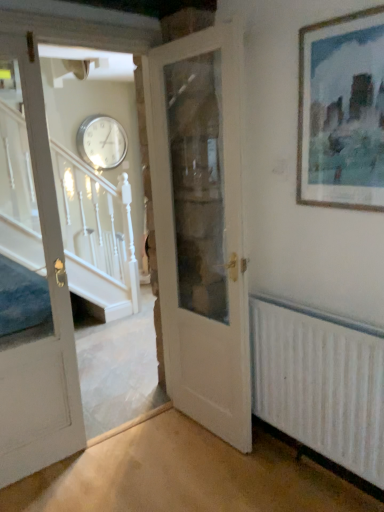
Question: Is point (43, 168) positioned closer to the camera than point (349, 31)?

Choices:
 (A) closer
 (B) farther

Answer: (B)

Question: In terms of height, does white painted wood door at left, arranged as the 2th door when viewed from the right, look taller or shorter compared to wooden picture frame at upper right?

Choices:
 (A) tall
 (B) short

Answer: (A)

Question: Which object is the farthest from the white textured radiator at lower right?

Choices:
 (A) wooden picture frame at upper right
 (B) silver metallic clock at upper center
 (C) white wooden door at center, placed as the 1th door when sorted from right to left
 (D) white painted wood door at left, arranged as the 2th door when viewed from the right

Answer: (B)

Question: Considering the real-world distances, which object is farthest from the white painted wood door at left, the first door viewed from the left?

Choices:
 (A) white wooden door at center, the 2th door from the left
 (B) white textured radiator at lower right
 (C) wooden picture frame at upper right
 (D) silver metallic clock at upper center

Answer: (D)